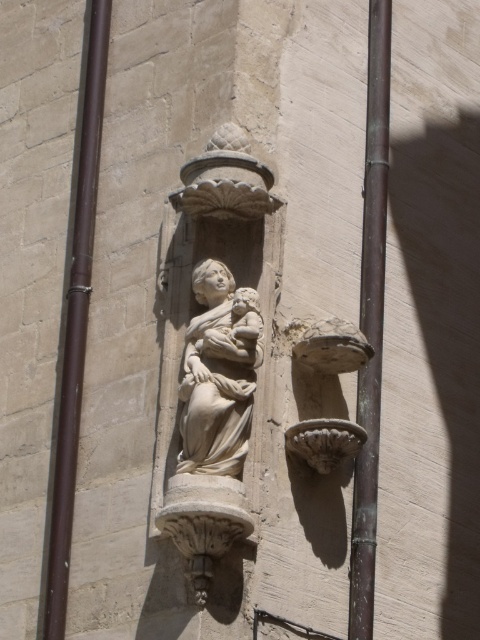
You are an architect inspecting the stone wall with the carved sculpture. You notice two poles, the brown metal pole at left and the bronze metallic pole at center. Which pole takes up more space in the scene?

The bronze metallic pole at center takes up more space than the brown metal pole at left because the brown metal pole at left occupies less space than bronze metallic pole at center.

You are standing in front of the stone wall with the carved sculpture. Where is the brown metal pole at left located relative to the sculpture?

The brown metal pole at left is located at point [73,323] relative to the sculpture.

You are a construction worker who needs to install a new light fixture between the brown metal pole at left and the stone wall sculpture. The light fixture requires a minimum of 40 meters of space between the pole and the sculpture. Can you safely install it here?

The distance between the brown metal pole at left and the stone wall sculpture is 44.40 meters, which exceeds the required 40 meters. Therefore, the light fixture can be safely installed here.